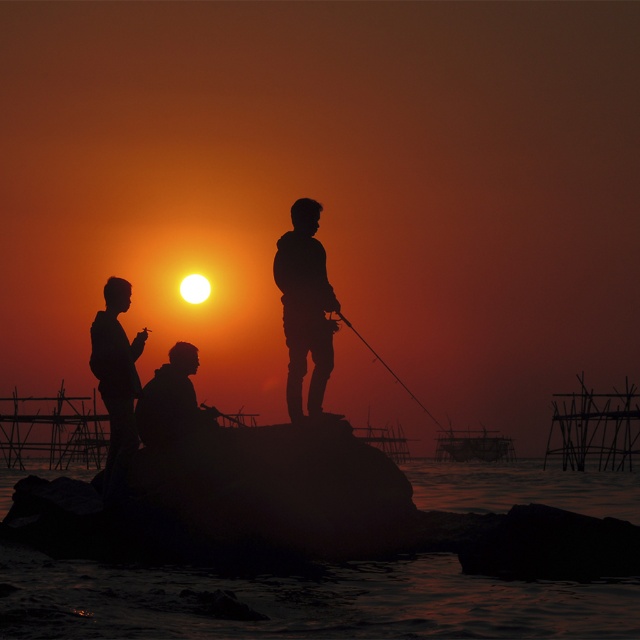
You are a photographer trying to capture the sunset scene. You notice the silhouette figure at left and the silvery metallic fishing pole at center. Which object appears smaller in the image?

The silhouette figure at left appears smaller compared to the silvery metallic fishing pole at center according to the description.

You are a photographer trying to capture the sunset. You notice the dark water at center and the silvery metallic fishing pole at center in your frame. Which object appears taller in the photo?

The silvery metallic fishing pole at center appears taller than the dark water at center in the photo because the dark water at center is not as tall as the silvery metallic fishing pole at center.